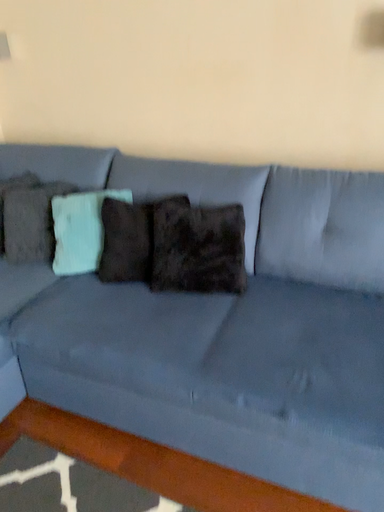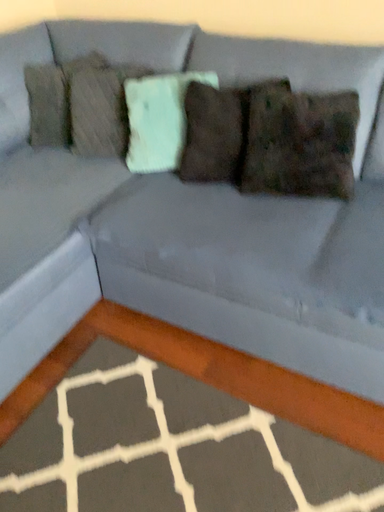
Question: Which way did the camera rotate in the video?

Choices:
 (A) rotated upward
 (B) rotated downward

Answer: (B)